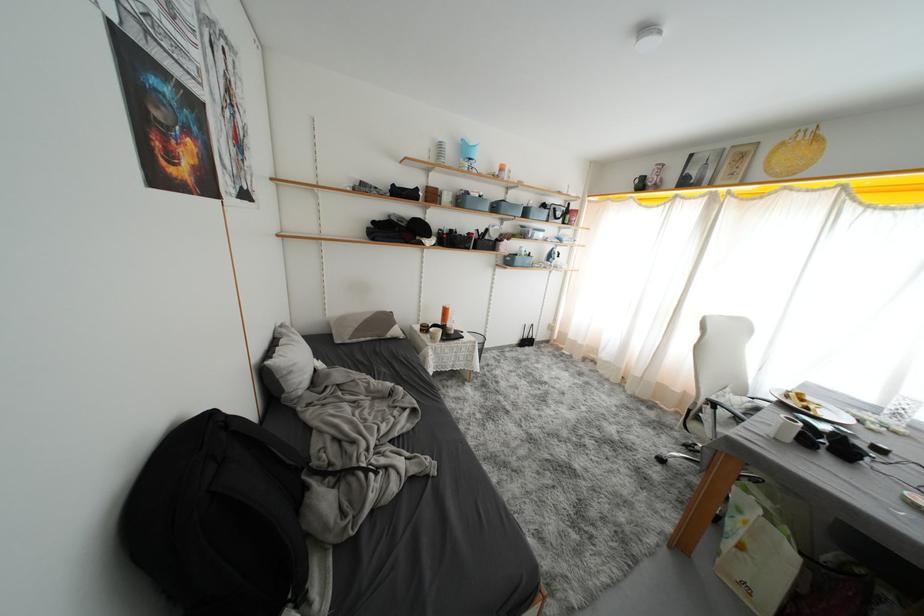
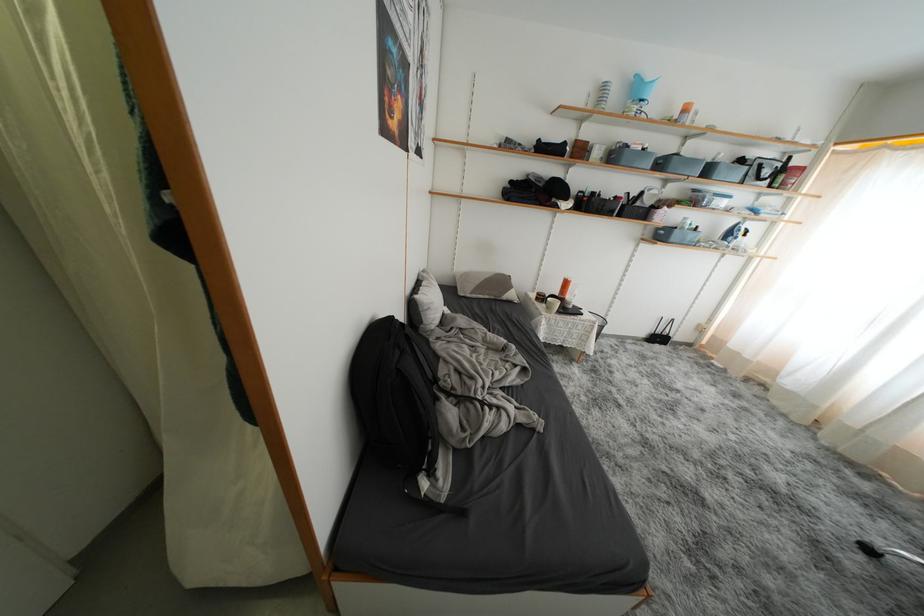
Question: I am providing you with two images of the same scene from different viewpoints. After the viewpoint changes to image2, which objects are now occluded?

Choices:
 (A) grey patterned pillow
 (B) red spray can
 (C) bag handle
 (D) none of these

Answer: (D)